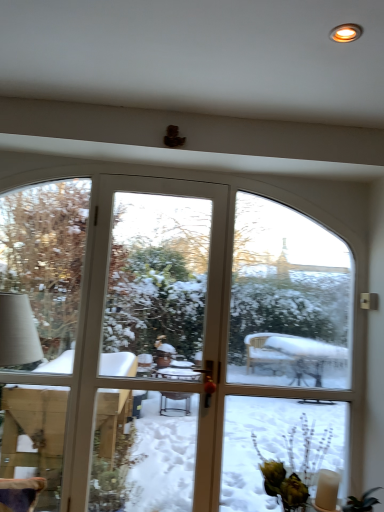
Where is `green leafy plant at lower right`? The height and width of the screenshot is (512, 384). green leafy plant at lower right is located at coordinates (295, 466).

Identify the location of matte gold light at upper right. The image size is (384, 512). (346, 33).

What do you see at coordinates (346, 33) in the screenshot? I see `matte gold light at upper right` at bounding box center [346, 33].

The height and width of the screenshot is (512, 384). What do you see at coordinates (285, 352) in the screenshot? I see `clear glass screen door at center` at bounding box center [285, 352].

Where is `green leafy plant at lower right`? The image size is (384, 512). green leafy plant at lower right is located at coordinates (295, 466).

Looking at this image, considering the relative positions of green leafy plant at lower right and matte gold light at upper right in the image provided, is green leafy plant at lower right to the right of matte gold light at upper right from the viewer's perspective?

Indeed, green leafy plant at lower right is positioned on the right side of matte gold light at upper right.

Between green leafy plant at lower right and matte gold light at upper right, which one has smaller size?

A: Smaller between the two is matte gold light at upper right.

How different are the orientations of green leafy plant at lower right and matte gold light at upper right in degrees?

The facing directions of green leafy plant at lower right and matte gold light at upper right are 92.6 degrees apart.

Is green leafy plant at lower right shorter than matte gold light at upper right?

In fact, green leafy plant at lower right may be taller than matte gold light at upper right.

From a real-world perspective, who is located higher, matte gold light at upper right or clear glass screen door at center?

In real-world perspective, matte gold light at upper right is above.

Does point (349, 35) lie behind point (254, 392)?

That is False.

Can you confirm if matte gold light at upper right is thinner than clear glass screen door at center?

No.

Is matte gold light at upper right positioned far away from clear glass screen door at center?

Yes, matte gold light at upper right and clear glass screen door at center are located far from each other.

Which point is more forward, (267, 316) or (263, 468)?

Point (263, 468)

Does clear glass screen door at center appear on the right side of green leafy plant at lower right?

Yes.

In the scene shown: From a real-world perspective, between clear glass screen door at center and green leafy plant at lower right, who is vertically higher?

clear glass screen door at center is physically above.

Which object is thinner, green leafy plant at lower right or clear glass screen door at center?

clear glass screen door at center.

Visually, is green leafy plant at lower right positioned to the left or to the right of clear glass screen door at center?

Based on their positions, green leafy plant at lower right is located to the left of clear glass screen door at center.

Would you say green leafy plant at lower right is inside or outside clear glass screen door at center?

green leafy plant at lower right is located beyond the bounds of clear glass screen door at center.

Does point (281, 486) appear closer or farther from the camera than point (225, 460)?

Point (281, 486) is closer to the camera than point (225, 460).

Does matte gold light at upper right appear on the left side of green leafy plant at lower right?

Correct, you'll find matte gold light at upper right to the left of green leafy plant at lower right.

Does point (330, 36) lie behind point (289, 432)?

No, (330, 36) is in front of (289, 432).

Consider the image. Considering the sizes of objects matte gold light at upper right and green leafy plant at lower right in the image provided, who is thinner, matte gold light at upper right or green leafy plant at lower right?

Thinner between the two is matte gold light at upper right.

Locate an element on the screen. light on the left of green leafy plant at lower right is located at coordinates (346, 33).

In terms of width, does clear glass screen door at center look wider or thinner when compared to matte gold light at upper right?

Considering their sizes, clear glass screen door at center looks slimmer than matte gold light at upper right.

Is matte gold light at upper right inside clear glass screen door at center?

No.

Is point (264, 212) farther from viewer compared to point (344, 39)?

Yes, point (264, 212) is behind point (344, 39).

Looking at this image, does clear glass screen door at center have a greater height compared to matte gold light at upper right?

Correct, clear glass screen door at center is much taller as matte gold light at upper right.

Identify the location of floral arrangement behind the matte gold light at upper right. The height and width of the screenshot is (512, 384). (295, 466).

The height and width of the screenshot is (512, 384). Identify the location of light in front of the clear glass screen door at center. (346, 33).

Which object lies further to the anchor point clear glass screen door at center, green leafy plant at lower right or matte gold light at upper right?

matte gold light at upper right lies further to clear glass screen door at center than the other object.

Considering their positions, is matte gold light at upper right positioned further to green leafy plant at lower right than clear glass screen door at center?

matte gold light at upper right is positioned further to the anchor green leafy plant at lower right.

When comparing their distances from matte gold light at upper right, does green leafy plant at lower right or clear glass screen door at center seem further?

clear glass screen door at center is positioned further to the anchor matte gold light at upper right.

Based on the photo, from the image, which object appears to be farther from clear glass screen door at center, matte gold light at upper right or green leafy plant at lower right?

Based on the image, matte gold light at upper right appears to be further to clear glass screen door at center.

From the picture: Based on their spatial positions, is clear glass screen door at center or green leafy plant at lower right further from matte gold light at upper right?

clear glass screen door at center is further to matte gold light at upper right.

When comparing their distances from green leafy plant at lower right, does clear glass screen door at center or matte gold light at upper right seem closer?

Result: clear glass screen door at center is positioned closer to the anchor green leafy plant at lower right.

The height and width of the screenshot is (512, 384). I want to click on screen door between matte gold light at upper right and green leafy plant at lower right in the up-down direction, so click(x=285, y=352).